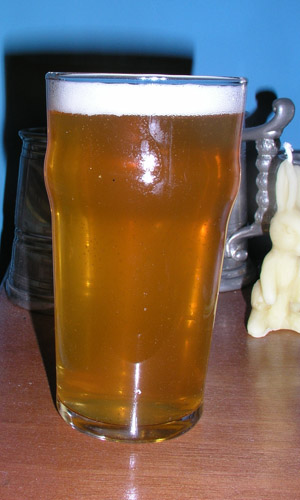
This screenshot has width=300, height=500. I want to click on metal cups, so click(x=37, y=241), click(x=235, y=270).